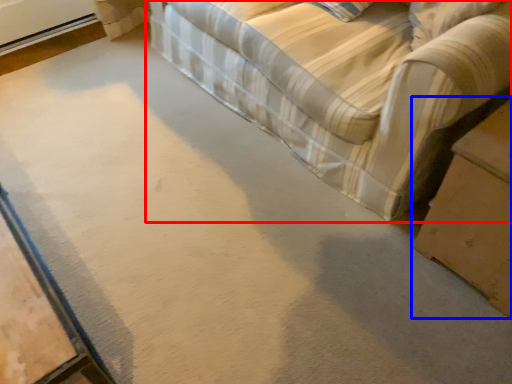
Question: Among these objects, which one is farthest to the camera, studio couch (highlighted by a red box) or table (highlighted by a blue box)?

Choices:
 (A) studio couch
 (B) table

Answer: (B)